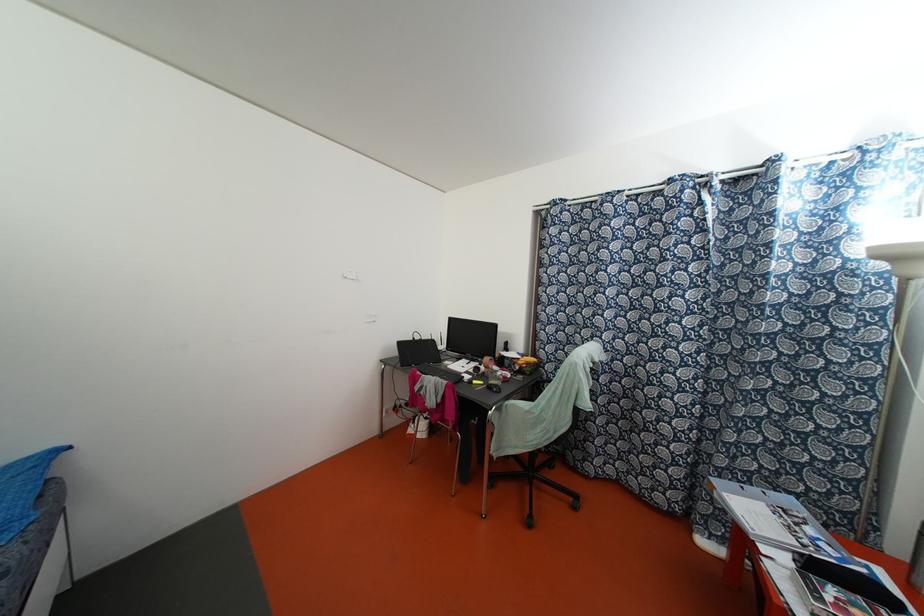
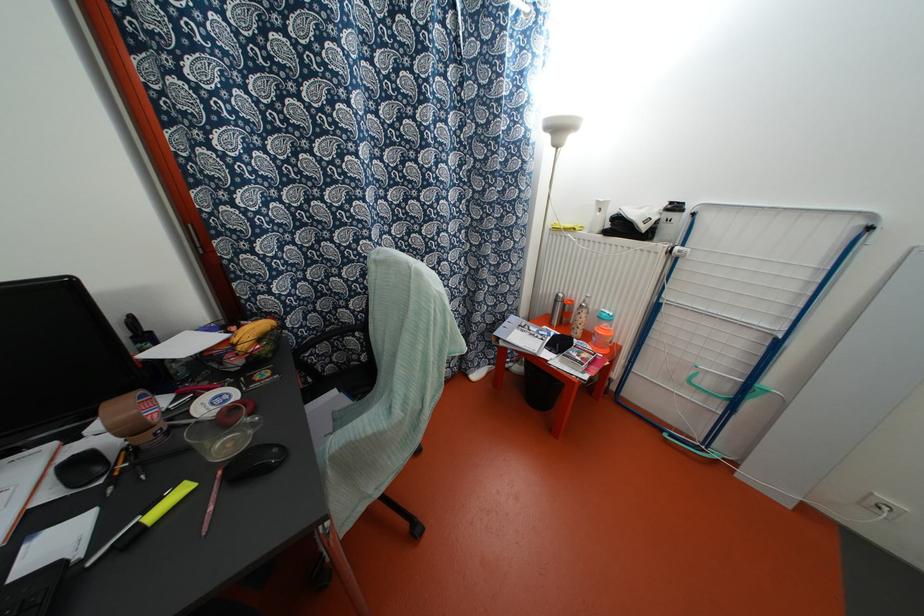
In the second image, find the point that corresponds to (x=473, y=381) in the first image.

(152, 515)